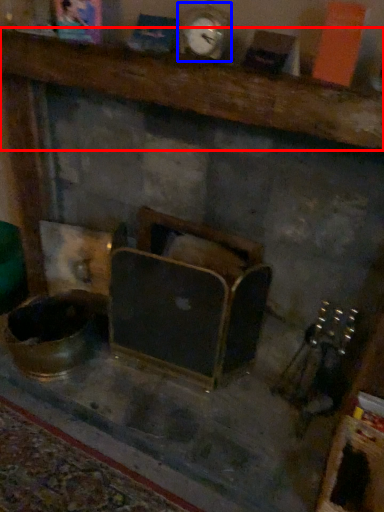
Question: Which object appears farthest to the camera in this image, furniture (highlighted by a red box) or clock (highlighted by a blue box)?

Choices:
 (A) furniture
 (B) clock

Answer: (B)